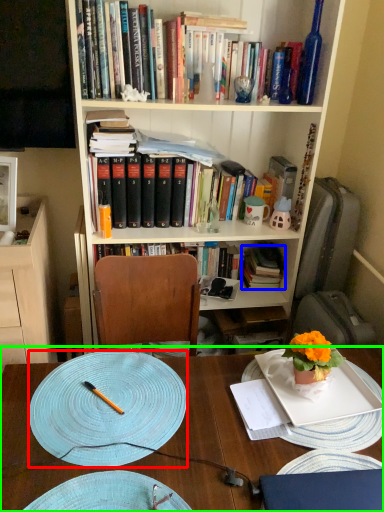
Question: Based on their relative distances, which object is farther from plate (highlighted by a red box)? Choose from book (highlighted by a blue box) and desk (highlighted by a green box).

Choices:
 (A) book
 (B) desk

Answer: (A)